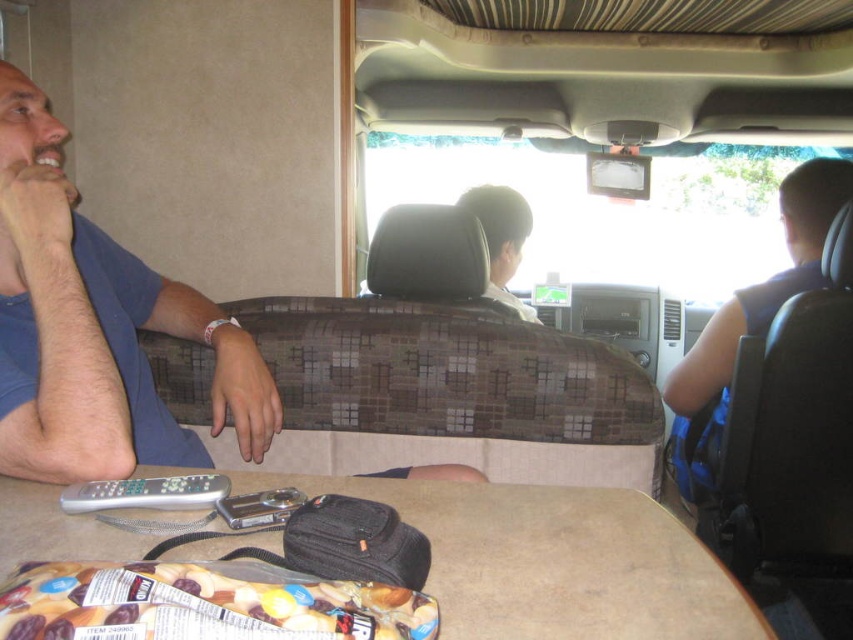
Question: Observing the image, what is the correct spatial positioning of blue sleeveless shirt at right in reference to dark gray fabric headrest at center?

Choices:
 (A) right
 (B) left

Answer: (A)

Question: Which point appears farthest from the camera in this image?

Choices:
 (A) (196, 490)
 (B) (674, 400)

Answer: (B)

Question: Which point appears farthest from the camera in this image?

Choices:
 (A) (190, 624)
 (B) (582, 564)
 (C) (502, 259)

Answer: (C)

Question: Which object appears closest to the camera in this image?

Choices:
 (A) blue sleeveless shirt at right
 (B) blue cotton shirt at left
 (C) chocolate-coated nuts at lower center

Answer: (C)

Question: From the image, what is the correct spatial relationship of brown matte table at lower center in relation to dark gray fabric headrest at center?

Choices:
 (A) right
 (B) left

Answer: (B)

Question: Where is brown matte table at lower center located in relation to blue sleeveless shirt at right in the image?

Choices:
 (A) above
 (B) below

Answer: (B)